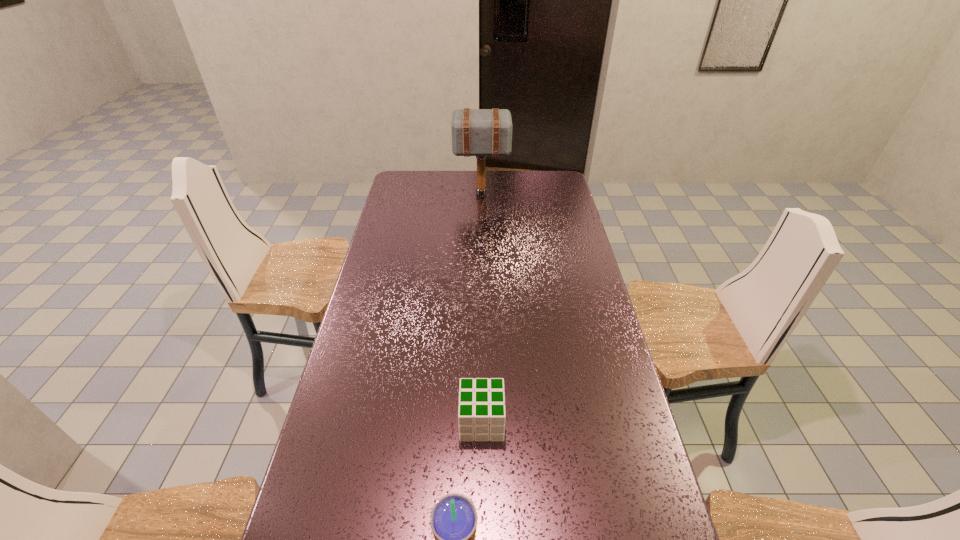
Locate an element on the screen. The width and height of the screenshot is (960, 540). the tallest object is located at coordinates (475, 132).

I want to click on the farthest object, so click(475, 132).

I want to click on the shortest object, so (481, 413).

Where is `the second farthest object`? Image resolution: width=960 pixels, height=540 pixels. the second farthest object is located at coordinates (481, 413).

Image resolution: width=960 pixels, height=540 pixels. I want to click on vacant space located on the striking surface of the tallest object, so click(412, 194).

Identify the location of vacant area situated 0.070m on the striking surface of the tallest object. The width and height of the screenshot is (960, 540). (440, 194).

I want to click on vacant position located on the striking surface of the tallest object, so click(415, 194).

The width and height of the screenshot is (960, 540). I want to click on free point located on the red face of the cube, so click(x=408, y=422).

Locate an element on the screen. vacant space situated on the red face of the cube is located at coordinates (393, 422).

Image resolution: width=960 pixels, height=540 pixels. In order to click on vacant space located 0.180m on the red face of the cube in this screenshot , I will do `click(393, 422)`.